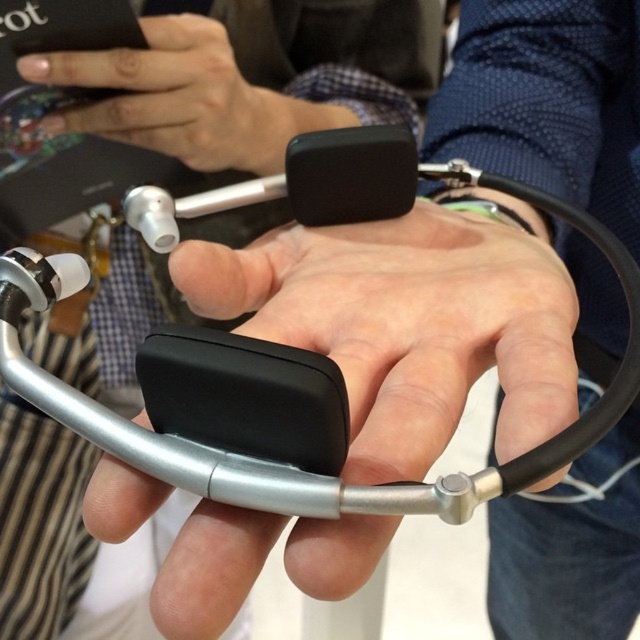
Question: Does black matte earbud at center have a lesser width compared to matte black phone at upper left?

Choices:
 (A) no
 (B) yes

Answer: (A)

Question: Is black matte stethoscope at center to the left of black matte earbud at center from the viewer's perspective?

Choices:
 (A) no
 (B) yes

Answer: (A)

Question: Can you confirm if black matte earbud at center is wider than matte black phone at upper left?

Choices:
 (A) yes
 (B) no

Answer: (A)

Question: Which of these objects is positioned closest to the black matte stethoscope at center?

Choices:
 (A) matte black phone at upper left
 (B) black matte earbud at center

Answer: (A)

Question: Which object appears closest to the camera in this image?

Choices:
 (A) black matte stethoscope at center
 (B) black matte earbud at center

Answer: (A)

Question: Which object appears farthest from the camera in this image?

Choices:
 (A) black matte stethoscope at center
 (B) black matte earbud at center
 (C) matte black phone at upper left

Answer: (B)